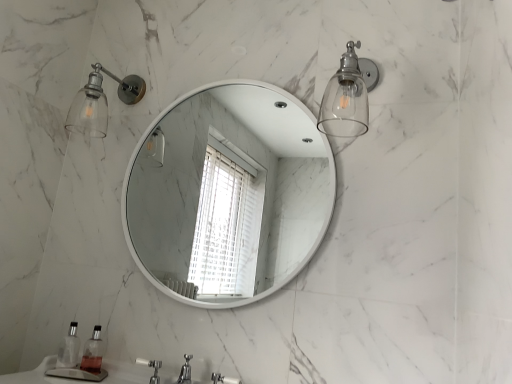
Question: Relative to white plastic faucet at lower center, is clear glass sconce at upper right in front or behind?

Choices:
 (A) behind
 (B) front

Answer: (B)

Question: Based on their sizes in the image, would you say clear glass sconce at upper right is bigger or smaller than white plastic faucet at lower center?

Choices:
 (A) big
 (B) small

Answer: (A)

Question: Estimate the real-world distances between objects in this image. Which object is closer to the white plastic faucet at lower center?

Choices:
 (A) clear plastic soap dispenser at lower left, placed as the first soap dispenser when sorted from left to right
 (B) clear glass soap dispenser at lower left, positioned as the second soap dispenser in left-to-right order
 (C) clear glass sconce at upper left
 (D) white glossy mirror at center
 (E) clear glass sconce at upper right

Answer: (B)

Question: Which is nearer to the clear glass soap dispenser at lower left, the 1th soap dispenser from the right?

Choices:
 (A) clear glass sconce at upper right
 (B) clear glass sconce at upper left
 (C) clear plastic soap dispenser at lower left, which ranks as the second soap dispenser in right-to-left order
 (D) white glossy mirror at center
 (E) white plastic faucet at lower center

Answer: (C)